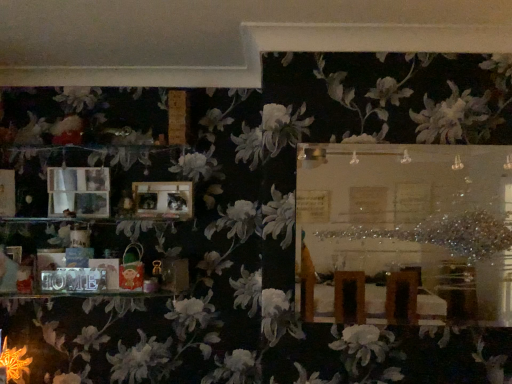
Question: From the image's perspective, would you say wooden frame at upper center is positioned over matte wooden picture frame at left, which is the second picture frame from right to left?

Choices:
 (A) no
 (B) yes

Answer: (A)

Question: Is wooden frame at upper center at the right side of matte wooden picture frame at left, the 1th picture frame from the left?

Choices:
 (A) yes
 (B) no

Answer: (A)

Question: Can you confirm if wooden frame at upper center is thinner than matte wooden picture frame at left, the 1th picture frame from the left?

Choices:
 (A) yes
 (B) no

Answer: (B)

Question: From the image's perspective, is wooden frame at upper center located beneath matte wooden picture frame at left, which is the second picture frame from right to left?

Choices:
 (A) no
 (B) yes

Answer: (B)

Question: Does wooden frame at upper center touch matte wooden picture frame at left, which is the second picture frame from right to left?

Choices:
 (A) no
 (B) yes

Answer: (A)

Question: Is wooden frame at upper center further to camera compared to matte wooden picture frame at left, the 1th picture frame from the left?

Choices:
 (A) no
 (B) yes

Answer: (A)

Question: Is wooden photo frame at center, the second picture frame positioned from the left, to the left of matte wooden picture frame at left, the 1th picture frame from the left, from the viewer's perspective?

Choices:
 (A) yes
 (B) no

Answer: (B)

Question: Is wooden photo frame at center, the first picture frame when ordered from right to left, closer to the viewer compared to matte wooden picture frame at left, the 1th picture frame from the left?

Choices:
 (A) no
 (B) yes

Answer: (B)

Question: Is wooden photo frame at center, the first picture frame when ordered from right to left, next to matte wooden picture frame at left, which is the second picture frame from right to left?

Choices:
 (A) no
 (B) yes

Answer: (A)

Question: From a real-world perspective, is wooden photo frame at center, the first picture frame when ordered from right to left, beneath matte wooden picture frame at left, the 1th picture frame from the left?

Choices:
 (A) no
 (B) yes

Answer: (B)

Question: Is wooden photo frame at center, the second picture frame positioned from the left, oriented towards matte wooden picture frame at left, the 1th picture frame from the left?

Choices:
 (A) no
 (B) yes

Answer: (A)

Question: Is wooden photo frame at center, the second picture frame positioned from the left, turned away from matte wooden picture frame at left, the 1th picture frame from the left?

Choices:
 (A) no
 (B) yes

Answer: (A)

Question: From a real-world perspective, is matte plastic bag at lower left located higher than wooden frame at upper center?

Choices:
 (A) yes
 (B) no

Answer: (B)